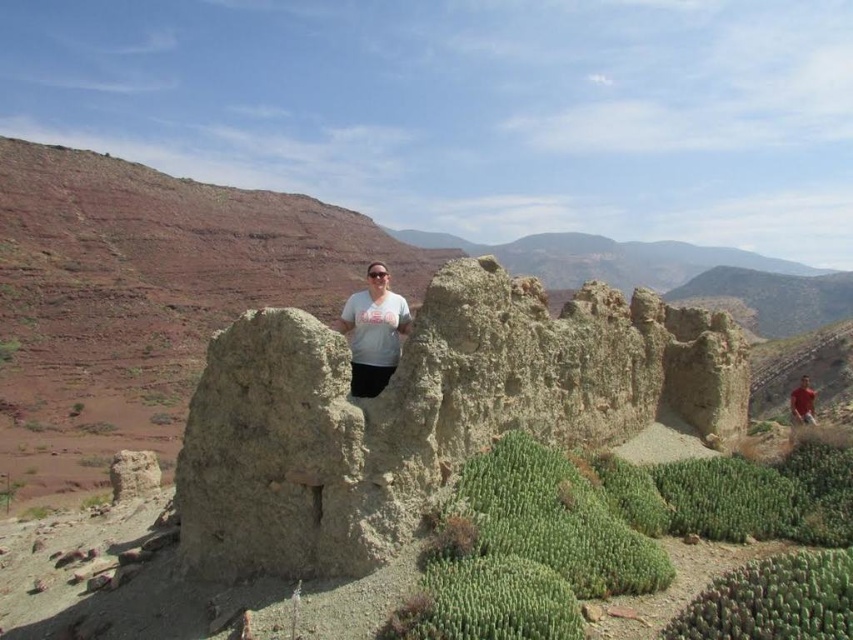
Does rustic stone structure at center appear under red cotton shirt at right?

No.

Which is in front, point (91, 276) or point (801, 388)?

Positioned in front is point (801, 388).

Between point (97, 321) and point (802, 406), which one is positioned in front?

Point (802, 406) is in front.

The height and width of the screenshot is (640, 853). I want to click on rustic stone structure at center, so click(144, 298).

Is light beige stone wall at center bigger than green spiky cactus at lower right?

Yes, light beige stone wall at center is bigger than green spiky cactus at lower right.

Is light beige stone wall at center positioned behind green spiky cactus at lower right?

Yes.

Is point (519, 316) closer to camera compared to point (683, 609)?

No.

Find the location of a particular element. The height and width of the screenshot is (640, 853). light beige stone wall at center is located at coordinates (422, 412).

Between point (163, 332) and point (813, 632), which one is positioned behind?

The point (163, 332) is behind.

Between rustic stone structure at center and green succulent at center, which one has less height?

green succulent at center

Does point (90, 260) lie behind point (529, 531)?

Yes, it is behind point (529, 531).

Find the location of a particular element. The height and width of the screenshot is (640, 853). rustic stone structure at center is located at coordinates (144, 298).